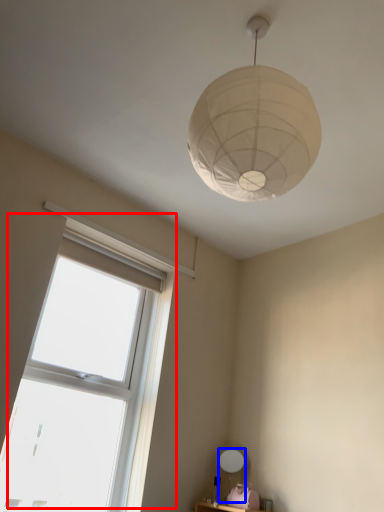
Question: Which object appears farthest to the camera in this image, window (highlighted by a red box) or table lamp (highlighted by a blue box)?

Choices:
 (A) window
 (B) table lamp

Answer: (B)